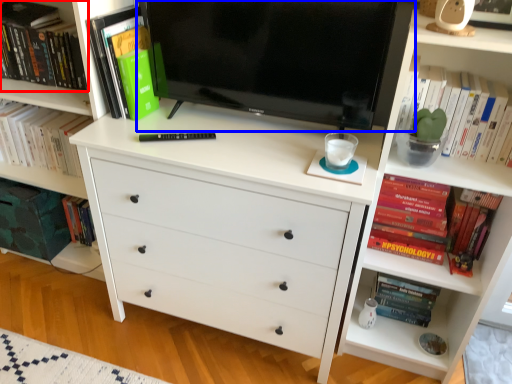
Question: Among these objects, which one is farthest to the camera, book (highlighted by a red box) or television (highlighted by a blue box)?

Choices:
 (A) book
 (B) television

Answer: (A)